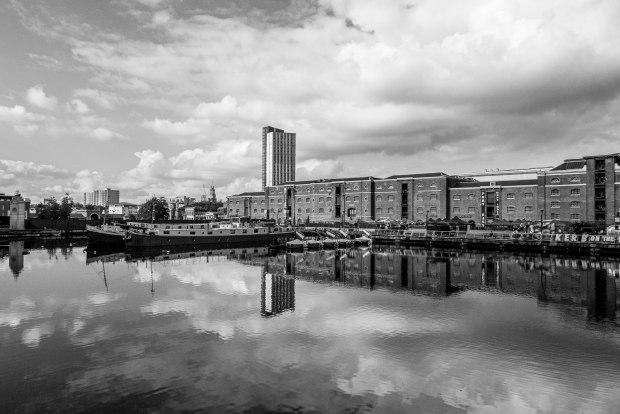
In order to click on black and white photograph in this screenshot , I will do `click(308, 166)`.